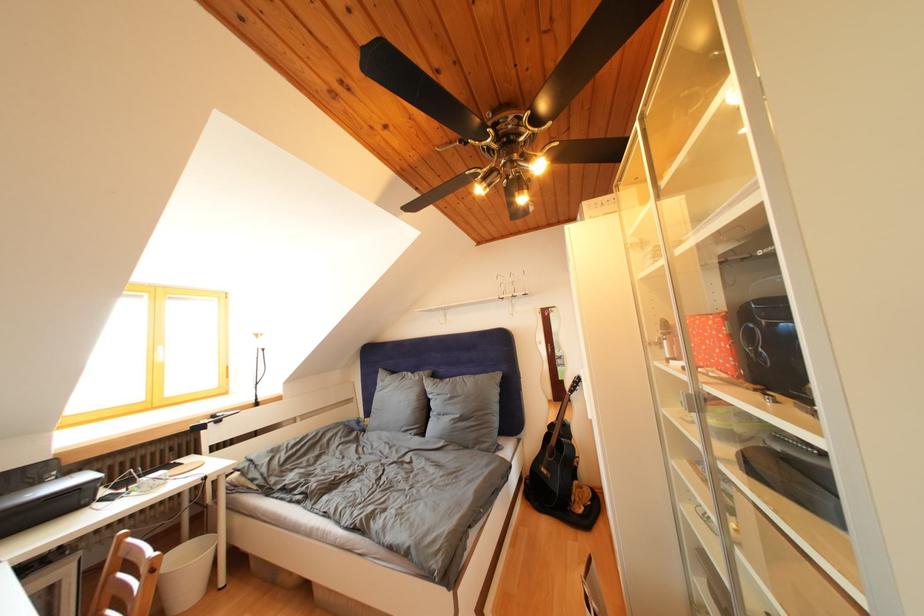
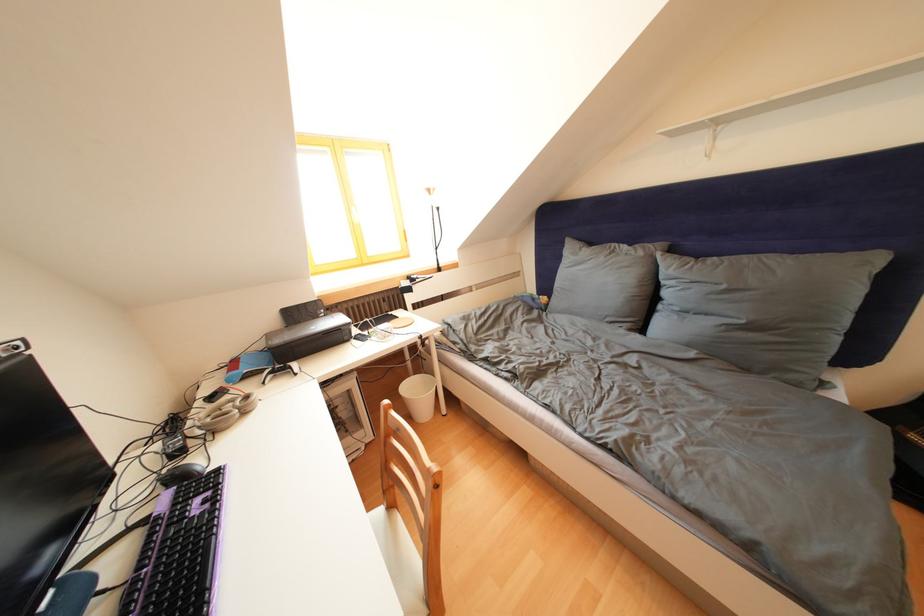
The images are taken continuously from a first-person perspective. In which direction is your viewpoint rotating?

The rotation direction of the camera is left-down.